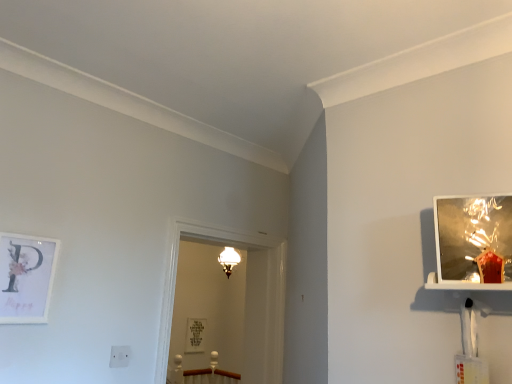
Question: Is white matte picture frame at left, the 2th picture frame in the bottom-to-top sequence, smaller than matte silver picture frame at center, the third picture frame positioned from the top?

Choices:
 (A) no
 (B) yes

Answer: (B)

Question: Can you confirm if white matte picture frame at left, which is the second picture frame from front to back, is bigger than matte silver picture frame at center, the third picture frame positioned from the top?

Choices:
 (A) no
 (B) yes

Answer: (A)

Question: Is white matte picture frame at left, which is the second picture frame from top to bottom, next to matte silver picture frame at center, which is counted as the second picture frame, starting from the right?

Choices:
 (A) yes
 (B) no

Answer: (B)

Question: Does white matte picture frame at left, the 2th picture frame in the bottom-to-top sequence, come in front of matte silver picture frame at center, which appears as the 2th picture frame when viewed from the left?

Choices:
 (A) yes
 (B) no

Answer: (A)

Question: From the image's perspective, does white matte picture frame at left, which is the first picture frame in left-to-right order, appear higher than matte silver picture frame at center, which is counted as the second picture frame, starting from the right?

Choices:
 (A) no
 (B) yes

Answer: (B)

Question: Is white matte picture frame at left, which is the second picture frame from top to bottom, in front of or behind metallic reflective picture frame at upper right, the third picture frame when ordered from bottom to top, in the image?

Choices:
 (A) front
 (B) behind

Answer: (B)

Question: From a real-world perspective, is white matte picture frame at left, the 2th picture frame in the bottom-to-top sequence, positioned above or below metallic reflective picture frame at upper right, the third picture frame when ordered from bottom to top?

Choices:
 (A) above
 (B) below

Answer: (B)

Question: Considering the relative positions of white matte picture frame at left, which is the second picture frame from top to bottom, and metallic reflective picture frame at upper right, which ranks as the 3th picture frame in left-to-right order, in the image provided, is white matte picture frame at left, which is the second picture frame from top to bottom, to the left or to the right of metallic reflective picture frame at upper right, which ranks as the 3th picture frame in left-to-right order,?

Choices:
 (A) left
 (B) right

Answer: (A)

Question: Is point (30, 246) positioned closer to the camera than point (457, 279)?

Choices:
 (A) farther
 (B) closer

Answer: (A)

Question: Is clear glass door at center wider or thinner than matte white sconce at upper center?

Choices:
 (A) thin
 (B) wide

Answer: (B)

Question: Considering the relative positions of clear glass door at center and matte white sconce at upper center in the image provided, is clear glass door at center to the left or to the right of matte white sconce at upper center?

Choices:
 (A) right
 (B) left

Answer: (A)

Question: From their relative heights in the image, would you say clear glass door at center is taller or shorter than matte white sconce at upper center?

Choices:
 (A) tall
 (B) short

Answer: (A)

Question: Is clear glass door at center spatially inside matte white sconce at upper center, or outside of it?

Choices:
 (A) inside
 (B) outside

Answer: (B)

Question: Is matte white sconce at upper center in front of or behind metallic reflective picture frame at upper right, acting as the first picture frame starting from the right, in the image?

Choices:
 (A) behind
 (B) front

Answer: (A)

Question: From a real-world perspective, is matte white sconce at upper center physically located above or below metallic reflective picture frame at upper right, positioned as the 3th picture frame in back-to-front order?

Choices:
 (A) below
 (B) above

Answer: (B)